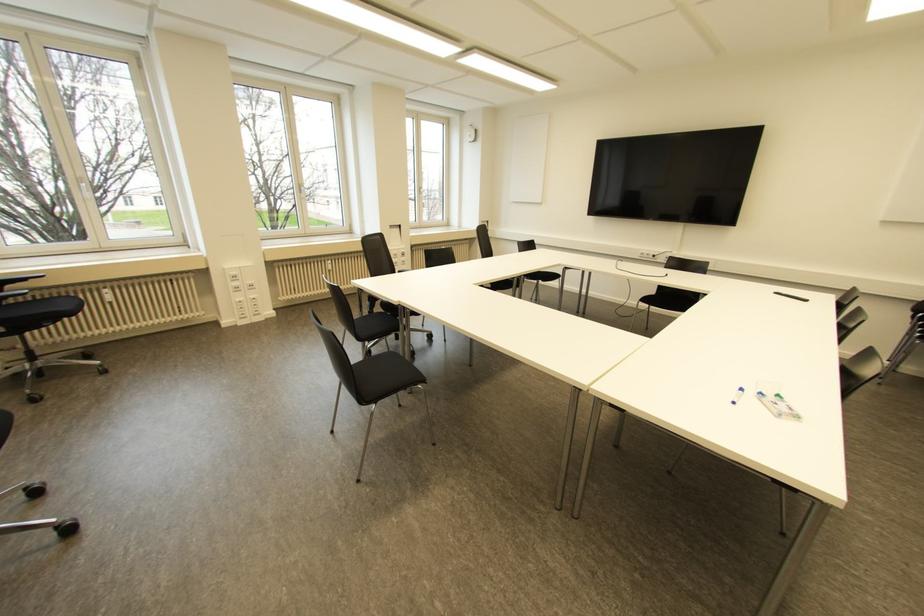
Find where to resting arm the black chair armrest. Please return your answer as a coordinate pair (x, y).

(11, 294)